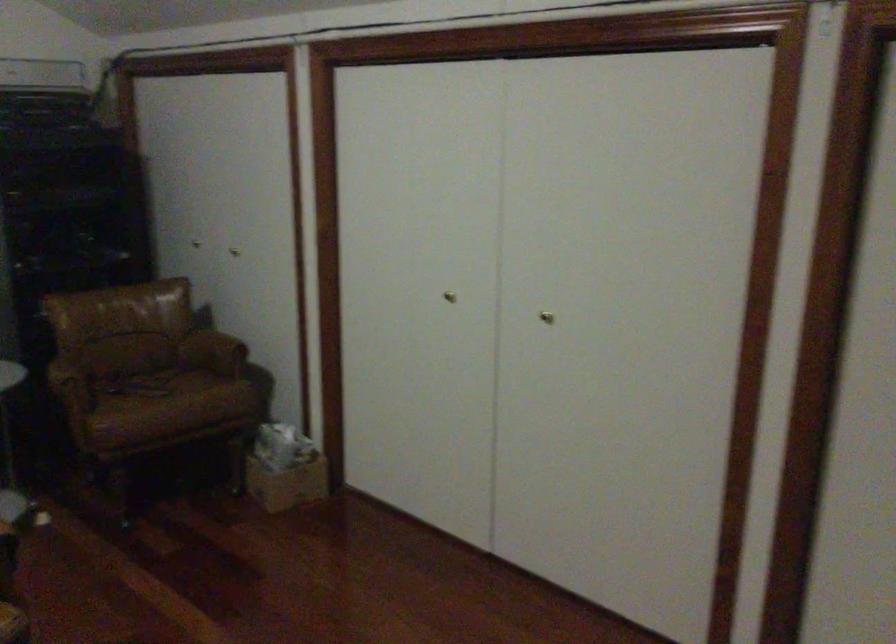
Image resolution: width=896 pixels, height=644 pixels. What do you see at coordinates (157, 388) in the screenshot? I see `the chair sitting surface` at bounding box center [157, 388].